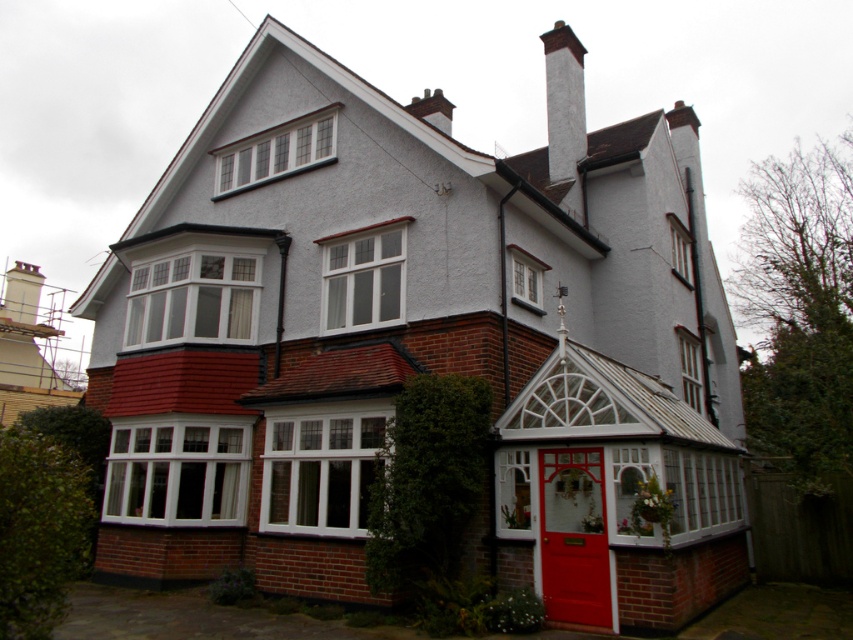
Between point (560, 541) and point (583, 100), which one is positioned in front?

Positioned in front is point (560, 541).

Does white glass conservatory at center have a greater width compared to white smooth chimney at upper center?

No.

At what (x,y) coordinates should I click in order to perform the action: click on white glass conservatory at center. Please return your answer as a coordinate pair (x, y). Image resolution: width=853 pixels, height=640 pixels. Looking at the image, I should click on (618, 492).